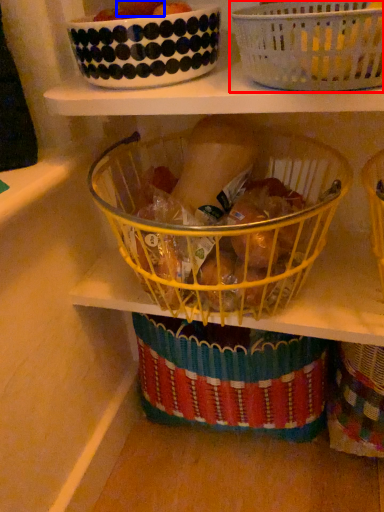
Question: Which object is further to the camera taking this photo, basket (highlighted by a red box) or fruit (highlighted by a blue box)?

Choices:
 (A) basket
 (B) fruit

Answer: (B)